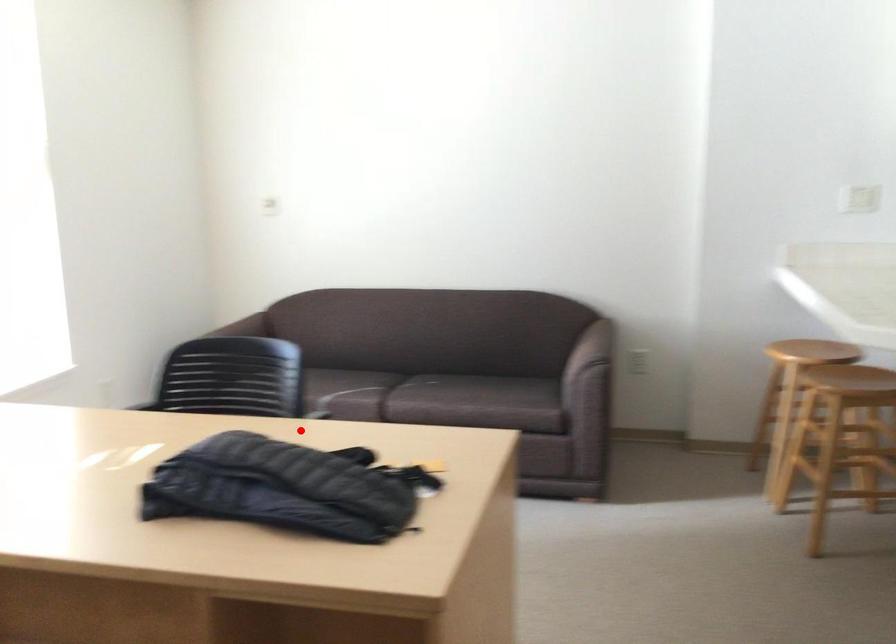
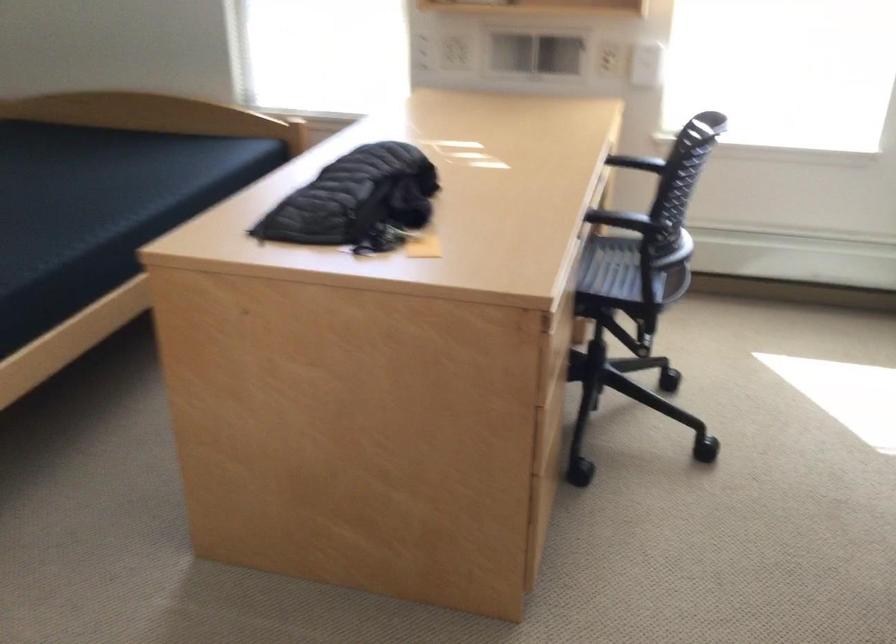
Question: I am providing you with two images of the same scene from different viewpoints. A red point is marked on the first image. Is the red point's position out of view in image 2?

Choices:
 (A) Yes
 (B) No

Answer: (B)